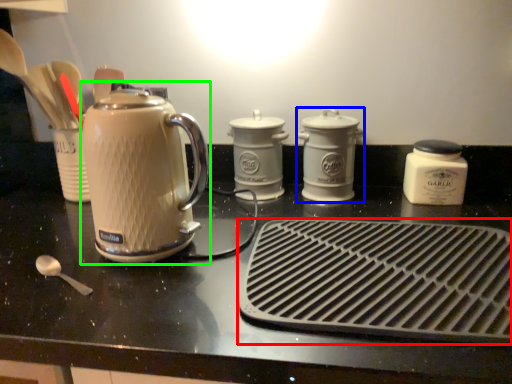
Question: Estimate the real-world distances between objects in this image. Which object is farther from kitchen appliance (highlighted by a red box), kitchen appliance (highlighted by a blue box) or kettle (highlighted by a green box)?

Choices:
 (A) kitchen appliance
 (B) kettle

Answer: (A)